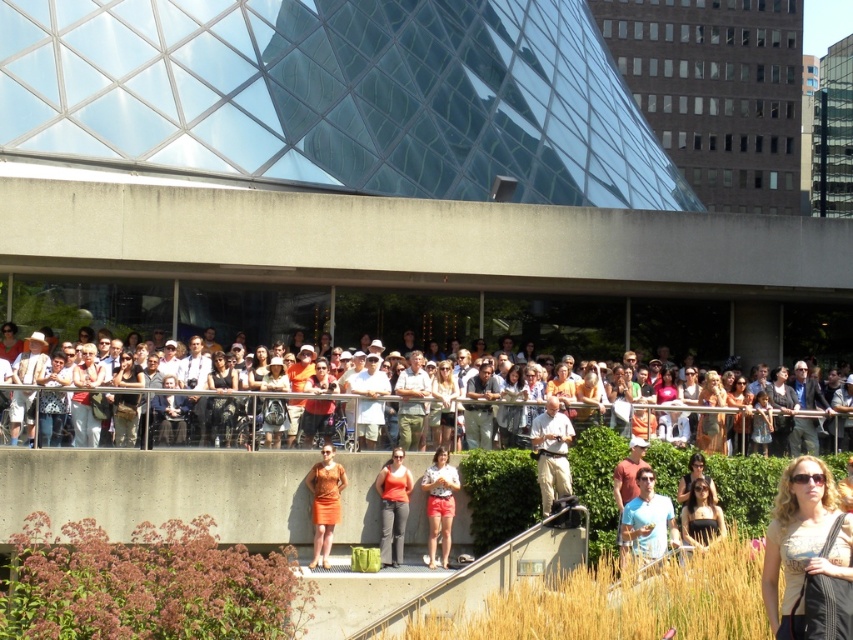
You are a photographer trying to capture a photo of the blue cotton shirt at center and the matte orange dress at lower right. Since you want both subjects in the frame, can you determine which one is positioned lower in the image?

The blue cotton shirt at center is located below matte orange dress at lower right, so the blue cotton shirt at center is positioned lower in the image.

You are a photographer wanting to capture a photo of the light brown leather jacket at lower right without the matte white crowd at center blocking it. Based on their sizes, is it possible to frame the shot so the jacket is visible without the crowd?

The matte white crowd at center is larger in size than the light brown leather jacket at lower right, so it might be challenging to frame the shot without the crowd blocking the jacket due to its larger size.

You are at the event and want to find the person wearing the orange fabric dress at center. Which direction should you look relative to the blue cotton shirt at center?

The blue cotton shirt at center is to the right of the orange fabric dress at center, so you should look to the left of the blue cotton shirt at center to find the orange fabric dress at center.